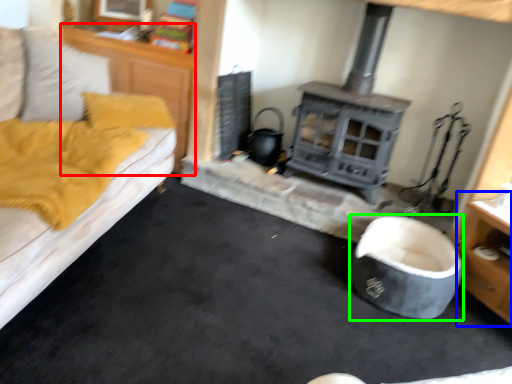
Question: Which is nearer to the dresser (highlighted by a red box)? dresser (highlighted by a blue box) or bean bag chair (highlighted by a green box).

Choices:
 (A) dresser
 (B) bean bag chair

Answer: (B)